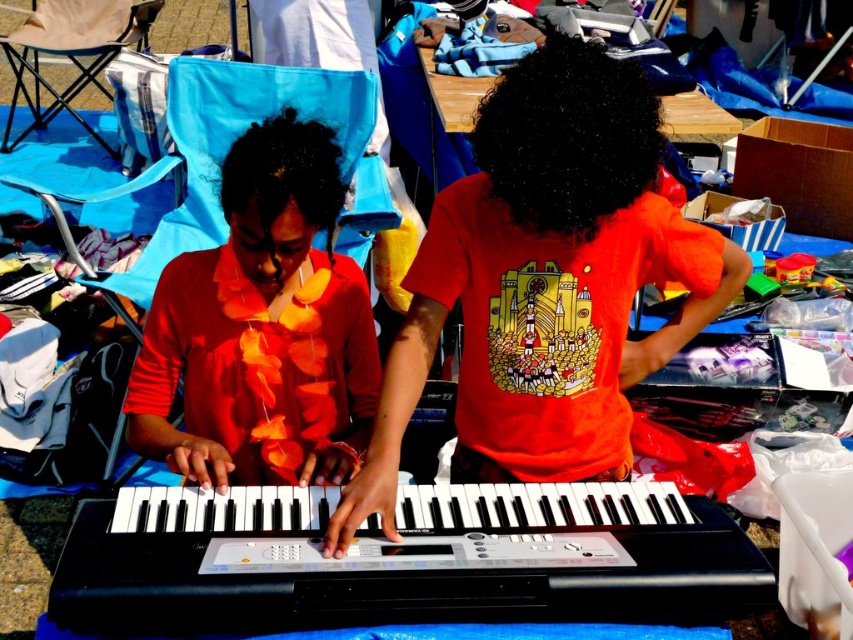
Does point (350, 387) come closer to viewer compared to point (641, 193)?

No, it is not.

Between matte orange dress at center and black curly hair at center, which one has more height?

With more height is matte orange dress at center.

Image resolution: width=853 pixels, height=640 pixels. I want to click on matte orange dress at center, so click(262, 328).

Who is taller, black plastic keyboard at center or matte orange dress at center?

matte orange dress at center

Between black plastic keyboard at center and matte orange dress at center, which one is positioned higher?

matte orange dress at center is higher up.

Between point (567, 484) and point (283, 465), which one is positioned in front?

Point (567, 484)

The image size is (853, 640). Find the location of `black plastic keyboard at center`. black plastic keyboard at center is located at coordinates (404, 560).

How distant is matte orange t-shirt at center from black curly hair at center?

3.86 inches

Does matte orange t-shirt at center have a lesser height compared to black curly hair at center?

No.

I want to click on matte orange t-shirt at center, so click(x=544, y=284).

Identify the location of matte orange t-shirt at center. The width and height of the screenshot is (853, 640). (544, 284).